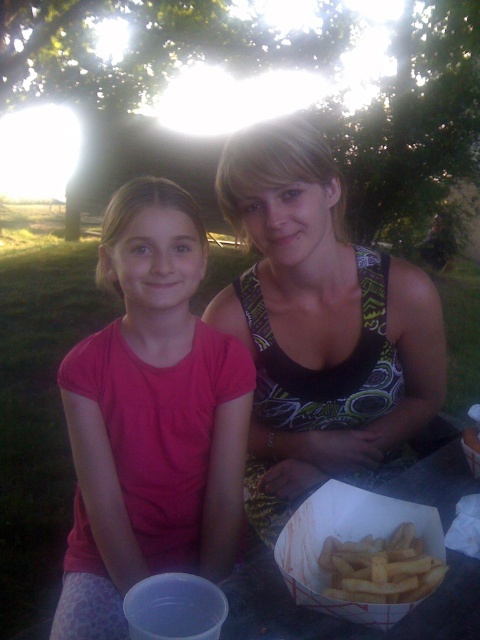
Between black printed tank top at center and golden crispy fries at lower center, which one appears on the right side from the viewer's perspective?

From the viewer's perspective, golden crispy fries at lower center appears more on the right side.

The height and width of the screenshot is (640, 480). Find the location of `black printed tank top at center`. black printed tank top at center is located at coordinates (319, 324).

The width and height of the screenshot is (480, 640). In order to click on black printed tank top at center in this screenshot , I will do `click(319, 324)`.

Between matte pink shirt at center and golden crispy fries at lower center, which one appears on the left side from the viewer's perspective?

Positioned to the left is matte pink shirt at center.

Between matte pink shirt at center and golden crispy fries at lower center, which one is positioned lower?

golden crispy fries at lower center

Is point (72, 611) in front of point (350, 598)?

No, (72, 611) is further to viewer.

I want to click on matte pink shirt at center, so click(x=151, y=419).

Can you confirm if matte pink shirt at center is taller than black printed tank top at center?

Yes.

Is point (184, 448) positioned before point (371, 451)?

Yes, point (184, 448) is closer to viewer.

Locate an element on the screen. This screenshot has width=480, height=640. matte pink shirt at center is located at coordinates (151, 419).

What are the coordinates of `matte pink shirt at center` in the screenshot? It's located at (151, 419).